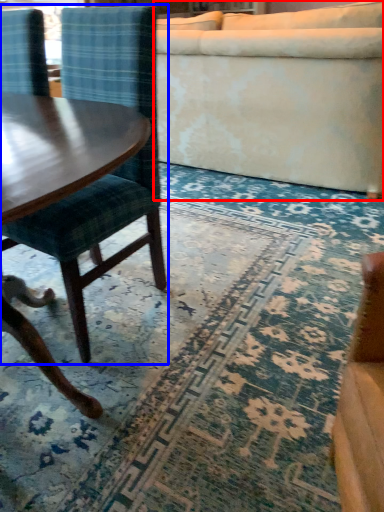
Question: Which object is closer to the camera taking this photo, studio couch (highlighted by a red box) or chair (highlighted by a blue box)?

Choices:
 (A) studio couch
 (B) chair

Answer: (B)